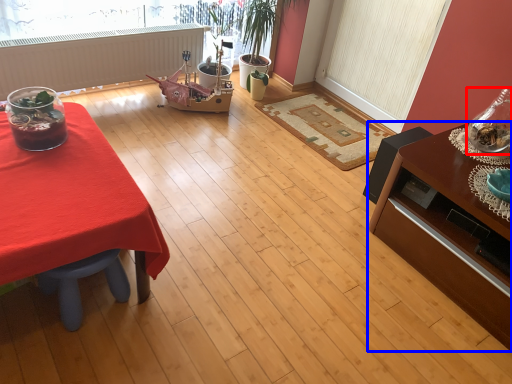
Question: Which point is further to the camera, glass vase (highlighted by a red box) or table (highlighted by a blue box)?

Choices:
 (A) glass vase
 (B) table

Answer: (A)